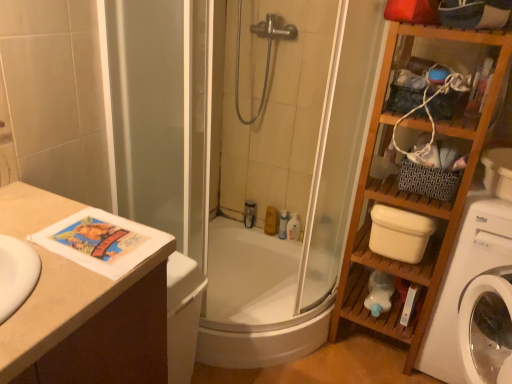
Question: Looking at the image, does translucent plastic bottle at upper center, the 1th toiletry viewed from the left, seem bigger or smaller compared to white plastic washing machine at right?

Choices:
 (A) big
 (B) small

Answer: (B)

Question: In the image, is translucent plastic bottle at upper center, the 4th toiletry viewed from the right, on the left side or the right side of white plastic washing machine at right?

Choices:
 (A) left
 (B) right

Answer: (A)

Question: Estimate the real-world distances between objects in this image. Which object is farther from the translucent plastic bottle at upper center, the 1th toiletry viewed from the left?

Choices:
 (A) white glossy bathtub at center
 (B) wooden shelf at right
 (C) white plastic toilet bowl at right
 (D) translucent plastic bottle at center, which is counted as the 3th toiletry, starting from the left
 (E) white plastic bottle at center, placed as the 1th toiletry when sorted from right to left

Answer: (B)

Question: Which of these objects is positioned closest to the silver metallic showerhead at upper center?

Choices:
 (A) white plastic washing machine at right
 (B) translucent plastic bottle at center, which is counted as the 2th toiletry, starting from the right
 (C) matte yellow soap at center, placed as the third toiletry when sorted from right to left
 (D) white plastic bottle at center, placed as the fourth toiletry when sorted from left to right
 (E) wooden shelf at right

Answer: (C)